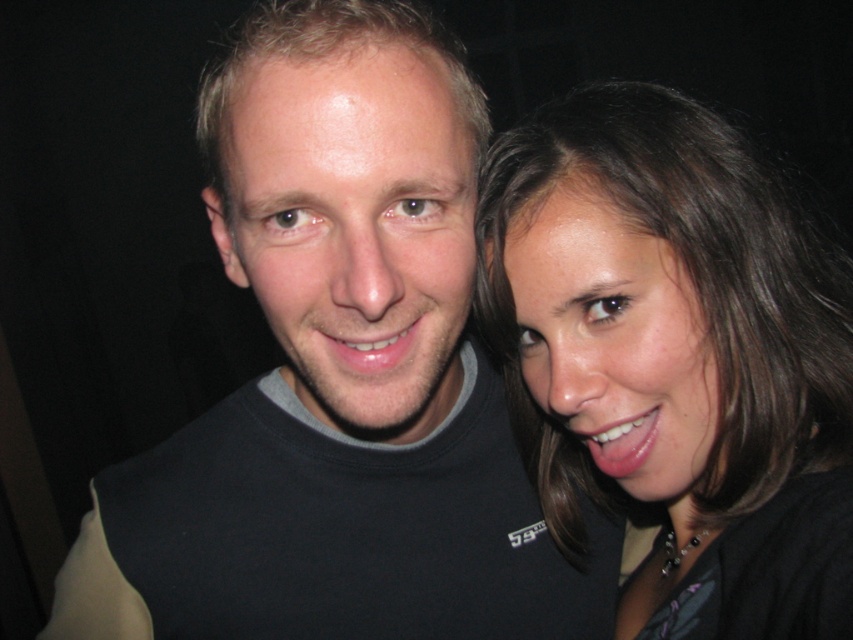
Question: Can you confirm if smooth brown hair at right is positioned below matte pink lips at center?

Choices:
 (A) no
 (B) yes

Answer: (B)

Question: Which of the following is the closest to the observer?

Choices:
 (A) black matte t-shirt at center
 (B) glossy white teeth at lower right
 (C) smooth brown hair at right
 (D) matte pink lips at center

Answer: (A)

Question: Is the position of smooth brown hair at right more distant than that of glossy white teeth at lower right?

Choices:
 (A) yes
 (B) no

Answer: (B)

Question: Which object is closer to the camera taking this photo?

Choices:
 (A) glossy white teeth at lower right
 (B) black matte t-shirt at center
 (C) matte pink lips at center

Answer: (B)

Question: Which object is the farthest from the black matte t-shirt at center?

Choices:
 (A) glossy white teeth at lower right
 (B) matte pink lips at center
 (C) smooth brown hair at right

Answer: (A)

Question: Is black matte t-shirt at center bigger than smooth brown hair at right?

Choices:
 (A) no
 (B) yes

Answer: (B)